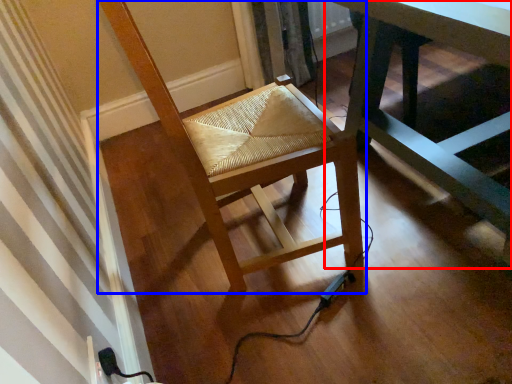
Question: Among these objects, which one is nearest to the camera, table (highlighted by a red box) or chair (highlighted by a blue box)?

Choices:
 (A) table
 (B) chair

Answer: (A)